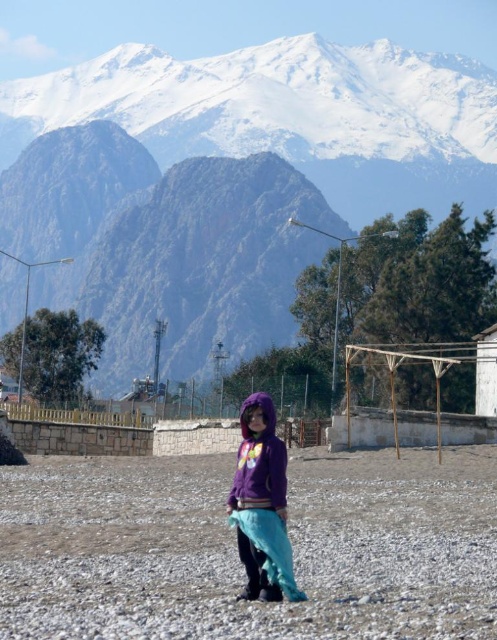
Who is lower down, snowy granite mountain range at upper center or white painted wood hut at right?

white painted wood hut at right is below.

Is snowy granite mountain range at upper center to the right of white painted wood hut at right from the viewer's perspective?

In fact, snowy granite mountain range at upper center is to the left of white painted wood hut at right.

Does point (253, 77) lie behind point (475, 403)?

Yes, point (253, 77) is behind point (475, 403).

You are a GUI agent. You are given a task and a screenshot of the screen. Output one action in this format:
    pyautogui.click(x=<x>, y=<y>)
    Task: Click on the snowy granite mountain range at upper center
    
    Given the screenshot: What is the action you would take?
    click(x=248, y=144)

Is point (307, 577) farther from camera compared to point (244, 561)?

Yes, point (307, 577) is behind point (244, 561).

Is point (355, 570) closer to viewer compared to point (281, 525)?

No, it is behind (281, 525).

Which is in front, point (447, 516) or point (251, 456)?

Point (251, 456)

At what (x,y) coordinates should I click in order to perform the action: click on dusty gravel at center. Please return your answer as a coordinate pair (x, y). Image resolution: width=497 pixels, height=640 pixels. Looking at the image, I should click on (237, 554).

Does dusty gravel at center lie behind white painted wood hut at right?

No, it is in front of white painted wood hut at right.

Does dusty gravel at center have a greater width compared to white painted wood hut at right?

Yes.

Measure the distance between dusty gravel at center and camera.

dusty gravel at center is 58.29 feet from camera.

Where is `dusty gravel at center`? This screenshot has width=497, height=640. dusty gravel at center is located at coordinates (237, 554).